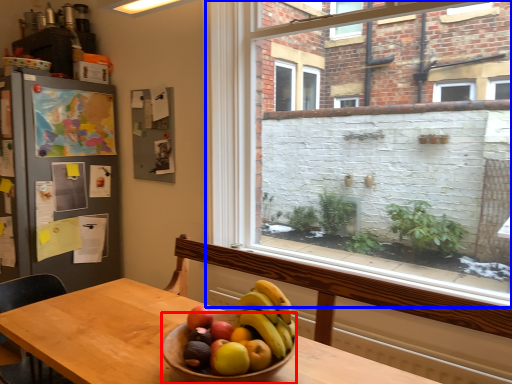
Question: Which object is closer to the camera taking this photo, bowl (highlighted by a red box) or window (highlighted by a blue box)?

Choices:
 (A) bowl
 (B) window

Answer: (A)